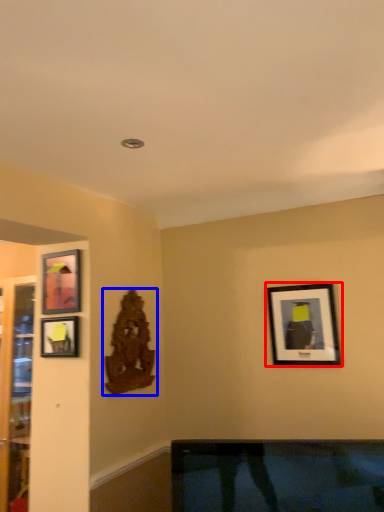
Question: Which of the following is the farthest to the observer, picture frame (highlighted by a red box) or art (highlighted by a blue box)?

Choices:
 (A) picture frame
 (B) art

Answer: (B)